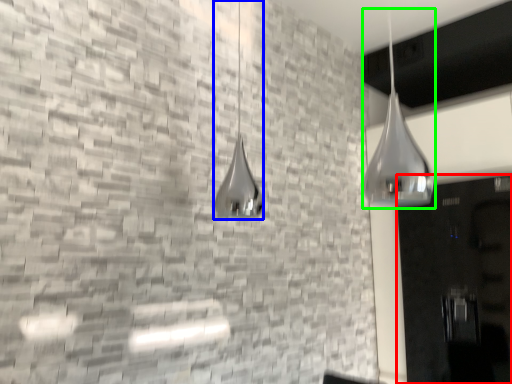
Question: Based on their relative distances, which object is farther from door (highlighted by a red box)? Choose from shower (highlighted by a blue box) and shower (highlighted by a green box).

Choices:
 (A) shower
 (B) shower

Answer: (A)